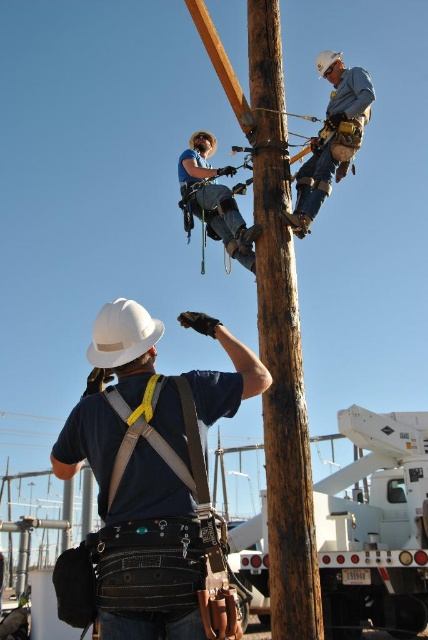
You are a safety inspector standing at the base of the utility pole. You need to ensure that the distance between the white matte hard hat at center and the blue denim jeans at upper center meets safety regulations, which require a minimum distance of 9 meters. Is the current distance compliant?

The white matte hard hat at center is 8.77 meters away from the blue denim jeans at upper center. Since 8.77 meters is less than the required 9 meters, the distance does not comply with safety regulations.

You are a safety inspector reviewing the image. According to safety protocols, all hard hats must be worn above the waist level. Does the white matte hard hat at center meet this requirement based on its position relative to the blue denim jeans at center?

The white matte hard hat at center is positioned under blue denim jeans at center, which means it is below waist level. This violates the safety protocol, so it does not meet the requirement.

You are a utility worker standing at the base of the pole and need to reach both the point at coordinates (366, 532) and the point at (146, 340). Which point should you ascend the pole to first to reach the closer one?

You should ascend the pole to reach the point at coordinates (146, 340) first because it is closer to you than the point at (366, 532), which is further away.